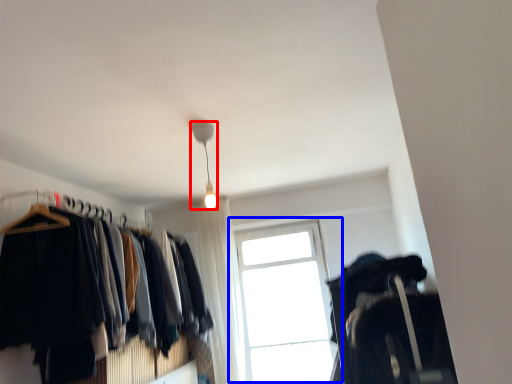
Question: Which of the following is the closest to the observer, lamp (highlighted by a red box) or window (highlighted by a blue box)?

Choices:
 (A) lamp
 (B) window

Answer: (A)